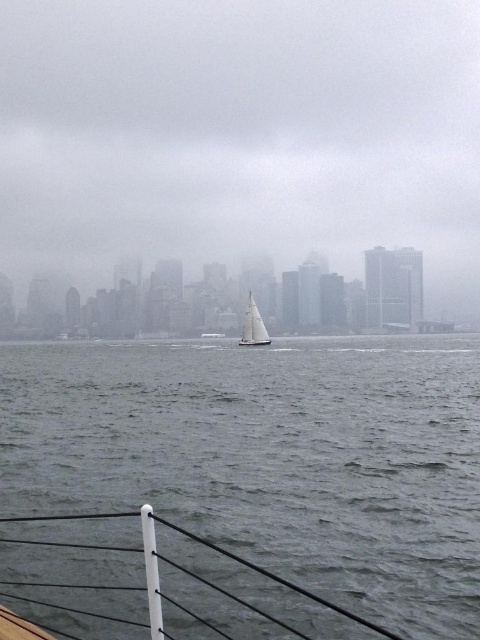
Question: From the image, what is the correct spatial relationship of gray matte water at center in relation to white matte sailboat at center?

Choices:
 (A) below
 (B) above

Answer: (A)

Question: Which point is farther from the camera taking this photo?

Choices:
 (A) (162, 108)
 (B) (120, 512)
 (C) (240, 340)

Answer: (A)

Question: Can you confirm if gray matte water at center is positioned to the right of white matte sailboat at center?

Choices:
 (A) yes
 (B) no

Answer: (B)

Question: Observing the image, what is the correct spatial positioning of gray matte water at center in reference to white matte sailboat at center?

Choices:
 (A) left
 (B) right

Answer: (A)

Question: Estimate the real-world distances between objects in this image. Which object is farther from the white matte boat at lower center?

Choices:
 (A) gray matte water at center
 (B) white sailboat at center

Answer: (B)

Question: Which of these objects is positioned farthest from the white sailboat at center?

Choices:
 (A) white matte sailboat at center
 (B) white matte boat at lower center
 (C) gray matte water at center

Answer: (B)